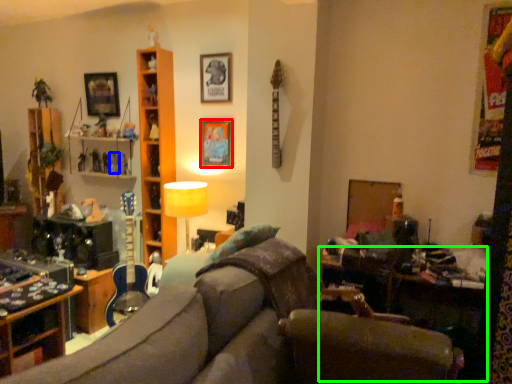
Question: Based on their relative distances, which object is farther from picture frame (highlighted by a red box)? Choose from toy (highlighted by a blue box) and table (highlighted by a green box).

Choices:
 (A) toy
 (B) table

Answer: (B)